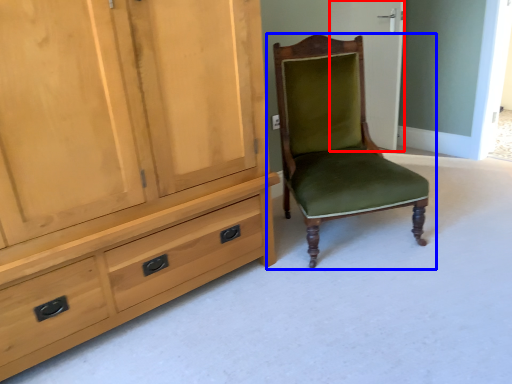
Question: Which object is closer to the camera taking this photo, screen door (highlighted by a red box) or chair (highlighted by a blue box)?

Choices:
 (A) screen door
 (B) chair

Answer: (B)